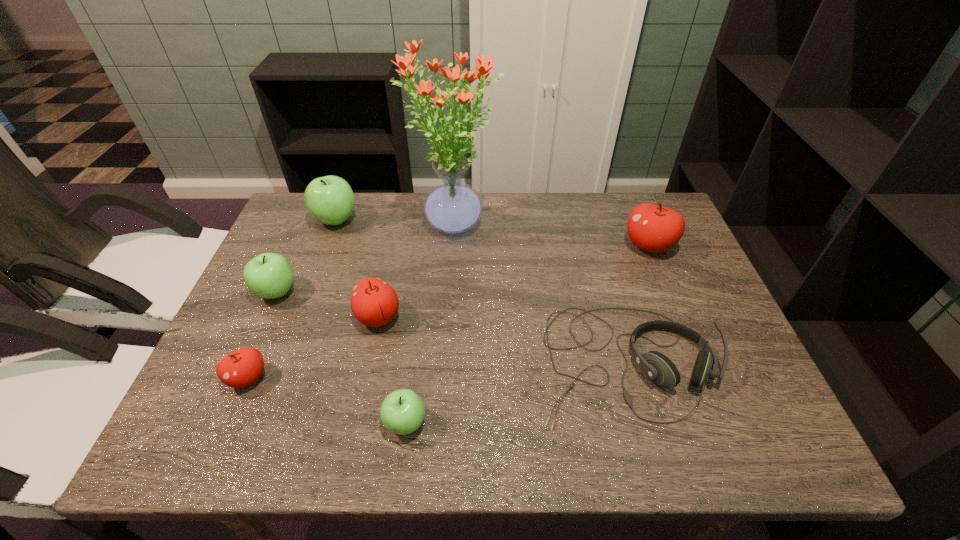
You are a GUI agent. You are given a task and a screenshot of the screen. Output one action in this format:
    pyautogui.click(x=<x>, y=<y>)
    Task: Click on the flower arrangement that is at the far edge
    This screenshot has height=540, width=960.
    Given the screenshot: What is the action you would take?
    pyautogui.click(x=452, y=207)

Locate an element on the screen. headset present at the near edge is located at coordinates (656, 366).

The height and width of the screenshot is (540, 960). Identify the location of apple situated at the near edge. (402, 412).

At what (x,y) coordinates should I click in order to perform the action: click on apple present at the right edge. Please return your answer as a coordinate pair (x, y). Image resolution: width=960 pixels, height=540 pixels. Looking at the image, I should click on (653, 228).

Find the location of `headset at the right edge`. headset at the right edge is located at coordinates (656, 366).

Where is `object that is at the far left corner`? object that is at the far left corner is located at coordinates (330, 199).

I want to click on object that is at the far right corner, so click(x=653, y=228).

In order to click on object that is at the near right corner in this screenshot , I will do pyautogui.click(x=656, y=366).

Where is `free space at the far edge of the desktop`? This screenshot has width=960, height=540. free space at the far edge of the desktop is located at coordinates (563, 236).

This screenshot has width=960, height=540. What are the coordinates of `vacant area at the near edge` in the screenshot? It's located at (471, 455).